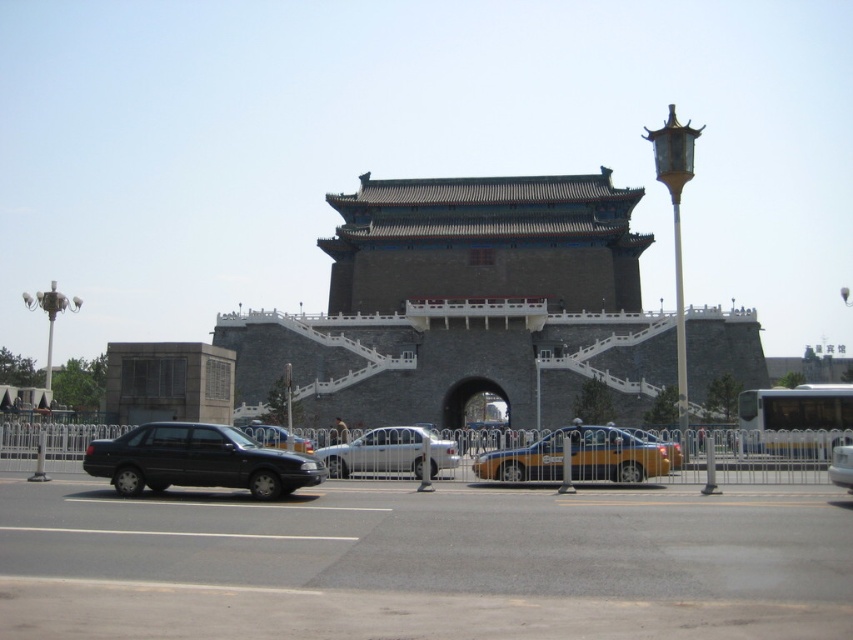
You are driving a matte black sedan at left and want to park it near the traditional Chinese gate. Given that the parking spot is 60 meters away from the camera, can you safely park the sedan there without moving it further?

The distance between the matte black sedan at left and the camera is 57.92 meters. Since the parking spot is 60 meters away from the camera, the sedan is closer than the required distance. Therefore, you need to move the sedan forward approximately 2.08 meters to reach the parking spot.

You are standing in front of a traditional Chinese gate with a dark brown stone facade. There is a point marked at coordinates (x=465, y=305). Which object is located at this point?

The dark gray stone fort at center is located at point (x=465, y=305).

You are a tourist standing at the base of the brown stone tower at center and want to take a photo that includes both the tower and the matte black sedan at left. Given that the sedan is smaller than the tower, where should you position yourself to ensure both are visible in the frame?

To include both the brown stone tower at center and the matte black sedan at left in the photo, position yourself at a distance where the larger brown stone tower at center and the smaller matte black sedan at left are both within the camera frame. Since the brown stone tower at center is larger, you might need to step back slightly to capture both in the shot.